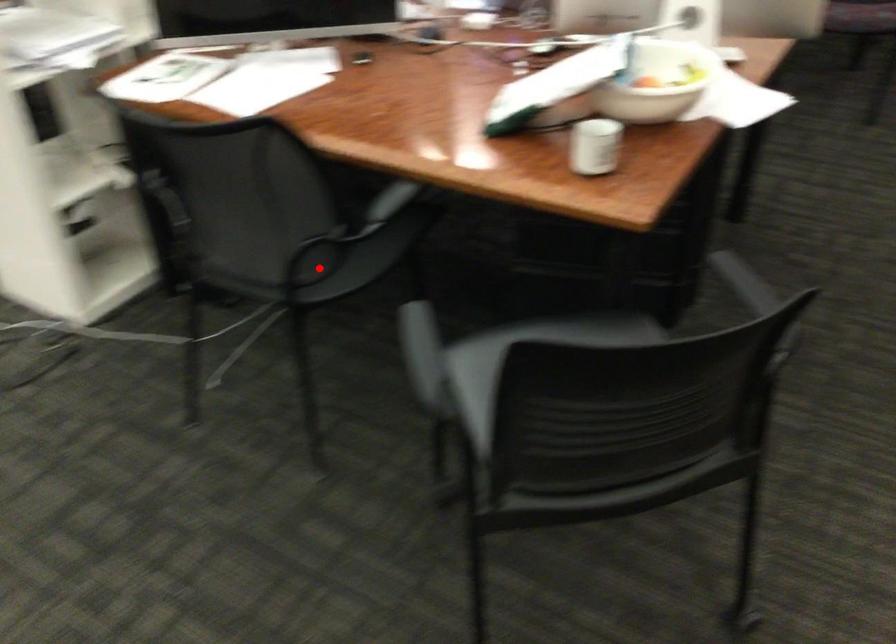
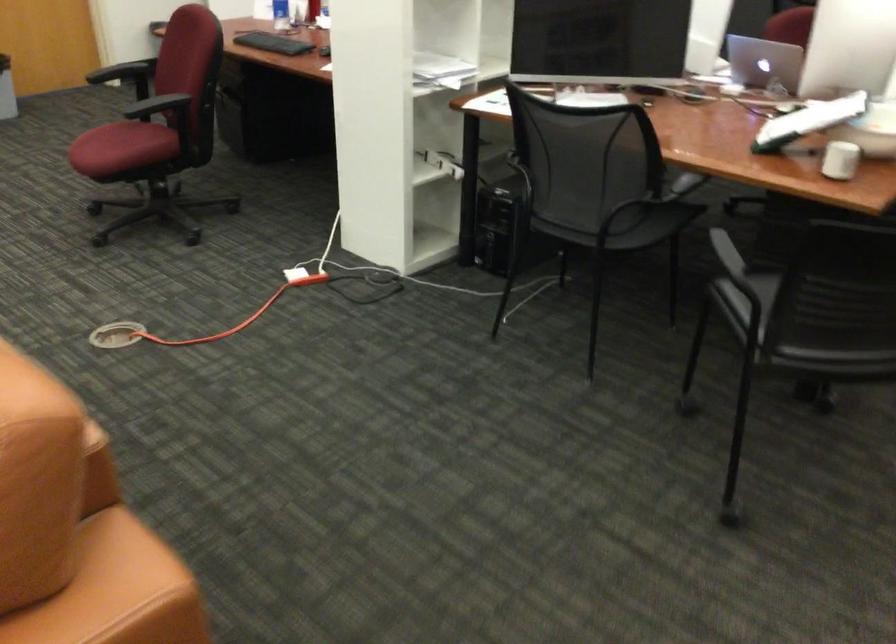
The point at the highlighted location is marked in the first image. Where is the corresponding point in the second image?

(615, 223)